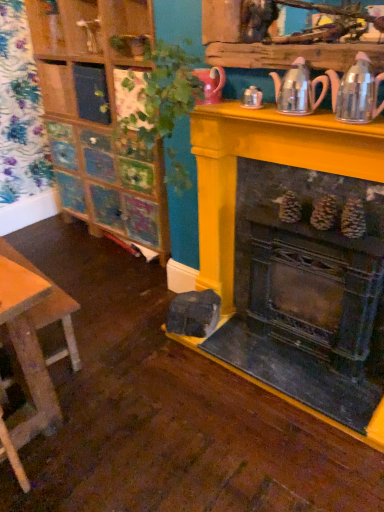
Question: Are green leafy plant at upper center and metallic silver tea pot at upper right, which is the 2th tea pot in left-to-right order, located far from each other?

Choices:
 (A) yes
 (B) no

Answer: (B)

Question: Considering the relative sizes of green leafy plant at upper center and metallic silver tea pot at upper right, arranged as the first tea pot when viewed from the right, in the image provided, is green leafy plant at upper center wider than metallic silver tea pot at upper right, arranged as the first tea pot when viewed from the right,?

Choices:
 (A) no
 (B) yes

Answer: (B)

Question: Can you confirm if green leafy plant at upper center is positioned to the left of metallic silver tea pot at upper right, arranged as the first tea pot when viewed from the right?

Choices:
 (A) no
 (B) yes

Answer: (B)

Question: From the image's perspective, is green leafy plant at upper center beneath metallic silver tea pot at upper right, which is the 2th tea pot in left-to-right order?

Choices:
 (A) no
 (B) yes

Answer: (B)

Question: Considering the relative sizes of green leafy plant at upper center and metallic silver tea pot at upper right, arranged as the first tea pot when viewed from the right, in the image provided, is green leafy plant at upper center smaller than metallic silver tea pot at upper right, arranged as the first tea pot when viewed from the right,?

Choices:
 (A) yes
 (B) no

Answer: (B)

Question: Can you confirm if green leafy plant at upper center is bigger than metallic silver tea pot at upper right, which is the 2th tea pot in left-to-right order?

Choices:
 (A) no
 (B) yes

Answer: (B)

Question: From the image's perspective, is metallic silver tea pot at upper right, arranged as the first tea pot when viewed from the right, located above rustic metal fireplace at center?

Choices:
 (A) no
 (B) yes

Answer: (B)

Question: Is metallic silver tea pot at upper right, which is the 2th tea pot in left-to-right order, to the left of rustic metal fireplace at center from the viewer's perspective?

Choices:
 (A) yes
 (B) no

Answer: (B)

Question: Is metallic silver tea pot at upper right, which is the 2th tea pot in left-to-right order, looking in the opposite direction of rustic metal fireplace at center?

Choices:
 (A) yes
 (B) no

Answer: (B)

Question: Can you see metallic silver tea pot at upper right, arranged as the first tea pot when viewed from the right, touching rustic metal fireplace at center?

Choices:
 (A) no
 (B) yes

Answer: (A)

Question: Is metallic silver tea pot at upper right, which is the 2th tea pot in left-to-right order, outside of rustic metal fireplace at center?

Choices:
 (A) no
 (B) yes

Answer: (B)

Question: Is metallic silver tea pot at upper right, which is the 2th tea pot in left-to-right order, oriented towards rustic metal fireplace at center?

Choices:
 (A) yes
 (B) no

Answer: (B)

Question: Is metallic silver tea pot at upper right, which is the 2th tea pot in left-to-right order, at the right side of green leafy plant at upper center?

Choices:
 (A) no
 (B) yes

Answer: (B)